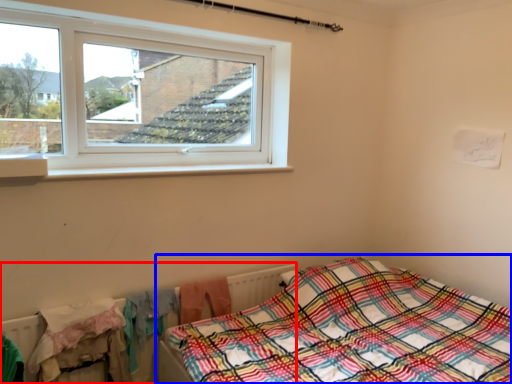
Question: Among these objects, which one is farthest to the camera, radiator (highlighted by a red box) or bed (highlighted by a blue box)?

Choices:
 (A) radiator
 (B) bed

Answer: (A)